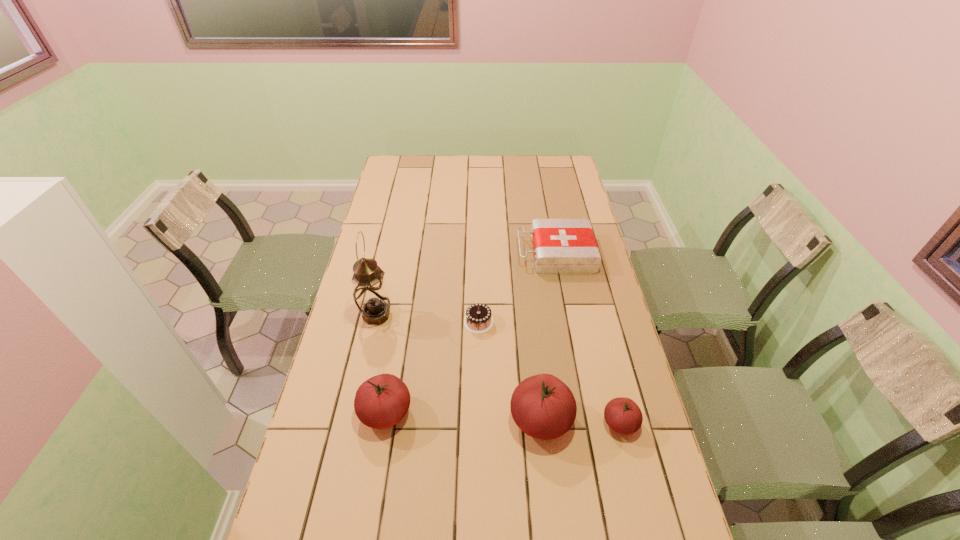
Please determine a free point for an extra tomato to ensure balance. Please provide its 2D coordinates. Your answer should be formatted as a tuple, i.e. [(x, y)], where the tuple contains the x and y coordinates of a point satisfying the conditions above.

[(463, 416)]